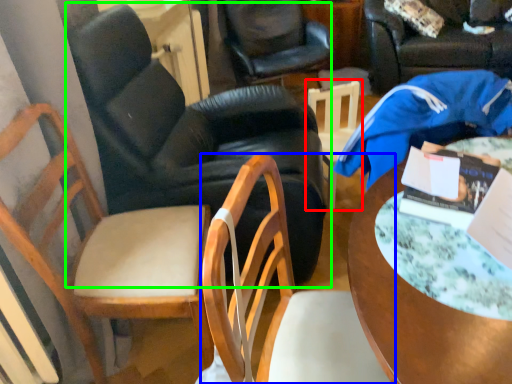
Question: Which object is positioned farthest from chair (highlighted by a red box)? Select from chair (highlighted by a blue box) and chair (highlighted by a green box).

Choices:
 (A) chair
 (B) chair

Answer: (A)